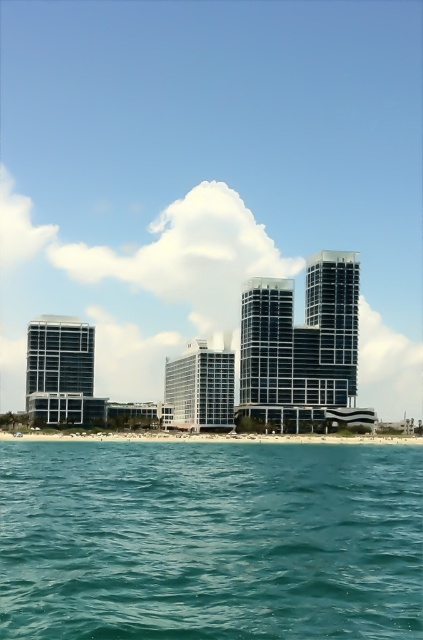
Who is taller, teal glossy water at lower center or white sand beach at lower center?

teal glossy water at lower center is taller.

Does teal glossy water at lower center have a lesser height compared to white sand beach at lower center?

Incorrect, teal glossy water at lower center's height does not fall short of white sand beach at lower center's.

Is point (96, 552) less distant than point (398, 435)?

Yes.

The image size is (423, 640). I want to click on teal glossy water at lower center, so point(209,540).